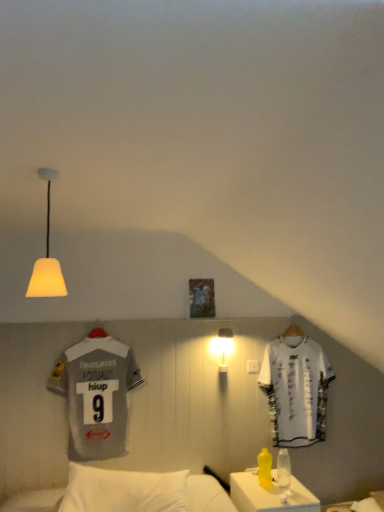
Question: Is white plastic table at lower right turned away from gray jersey at left, marked as the first sports uniform in a front-to-back arrangement?

Choices:
 (A) yes
 (B) no

Answer: (B)

Question: From the image's perspective, is white plastic table at lower right on gray jersey at left, the first sports uniform viewed from the left?

Choices:
 (A) no
 (B) yes

Answer: (A)

Question: Does white plastic table at lower right appear on the right side of gray jersey at left, which appears as the second sports uniform when viewed from the right?

Choices:
 (A) yes
 (B) no

Answer: (A)

Question: Does white plastic table at lower right lie behind gray jersey at left, which appears as the second sports uniform when viewed from the right?

Choices:
 (A) yes
 (B) no

Answer: (B)

Question: Is white plastic table at lower right oriented towards gray jersey at left, which is the 2th sports uniform from back to front?

Choices:
 (A) yes
 (B) no

Answer: (B)

Question: In the image, is white plastic table at lower right on the left side or the right side of yellow matte bottle at lower right, acting as the second bottle starting from the right?

Choices:
 (A) right
 (B) left

Answer: (A)

Question: From the image's perspective, relative to yellow matte bottle at lower right, which is counted as the 1th bottle, starting from the left, is white plastic table at lower right above or below?

Choices:
 (A) above
 (B) below

Answer: (B)

Question: In terms of size, does white plastic table at lower right appear bigger or smaller than yellow matte bottle at lower right, which is counted as the 1th bottle, starting from the left?

Choices:
 (A) small
 (B) big

Answer: (B)

Question: Looking at their shapes, would you say white plastic table at lower right is wider or thinner than yellow matte bottle at lower right, acting as the second bottle starting from the right?

Choices:
 (A) wide
 (B) thin

Answer: (A)

Question: From the image's perspective, is gray jersey at left, the first sports uniform viewed from the left, located above or below white matte lampshade at upper left, arranged as the second lamp when ordered from the bottom?

Choices:
 (A) above
 (B) below

Answer: (B)

Question: From a real-world perspective, is gray jersey at left, which appears as the second sports uniform when viewed from the right, above or below white matte lampshade at upper left, the first lamp viewed from the top?

Choices:
 (A) above
 (B) below

Answer: (B)

Question: Considering the positions of gray jersey at left, marked as the first sports uniform in a front-to-back arrangement, and white matte lampshade at upper left, arranged as the second lamp when ordered from the bottom, in the image, is gray jersey at left, marked as the first sports uniform in a front-to-back arrangement, taller or shorter than white matte lampshade at upper left, arranged as the second lamp when ordered from the bottom,?

Choices:
 (A) tall
 (B) short

Answer: (A)

Question: In terms of width, does gray jersey at left, the first sports uniform viewed from the left, look wider or thinner when compared to white matte lampshade at upper left, which is counted as the 1th lamp, starting from the front?

Choices:
 (A) thin
 (B) wide

Answer: (A)

Question: Does point (246, 484) appear closer or farther from the camera than point (119, 454)?

Choices:
 (A) farther
 (B) closer

Answer: (B)

Question: Which is correct: white plastic table at lower right is inside gray jersey at left, marked as the first sports uniform in a front-to-back arrangement, or outside of it?

Choices:
 (A) inside
 (B) outside

Answer: (B)